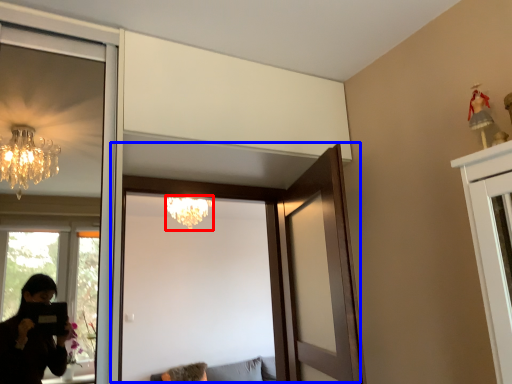
Question: Which of the following is the farthest to the observer, lamp (highlighted by a red box) or door (highlighted by a blue box)?

Choices:
 (A) lamp
 (B) door

Answer: (A)